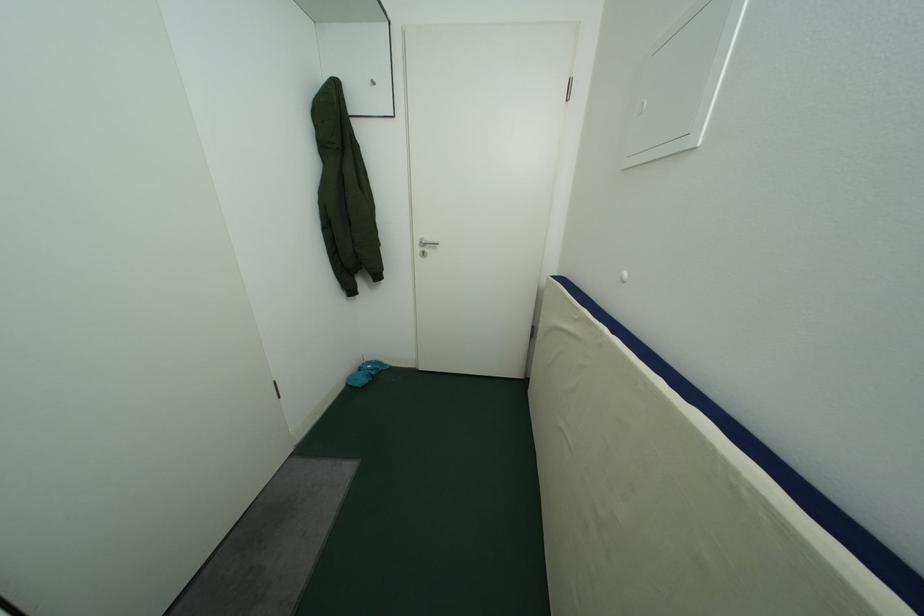
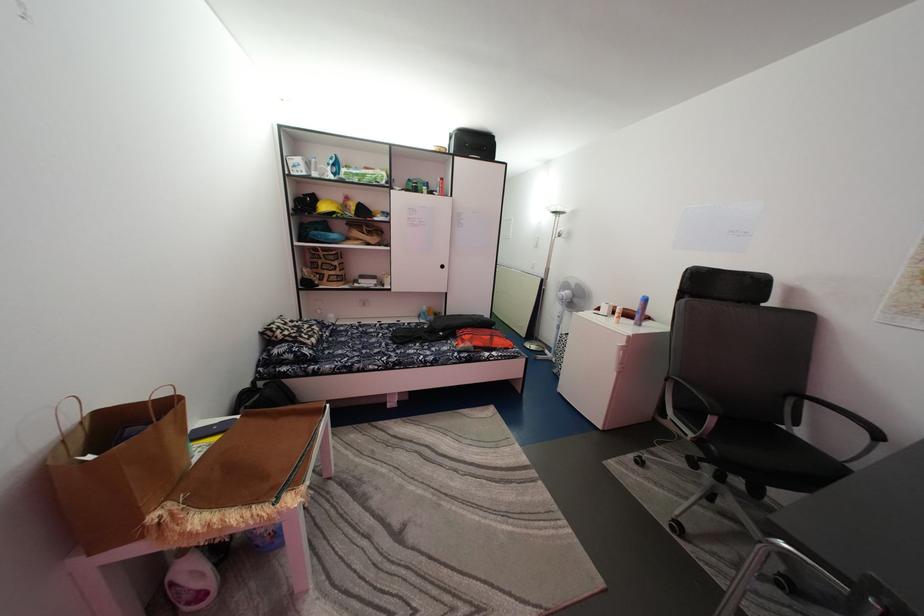
In a continuous first-person perspective shot, in which direction is the camera moving?

The cameraman moved toward left, backward.